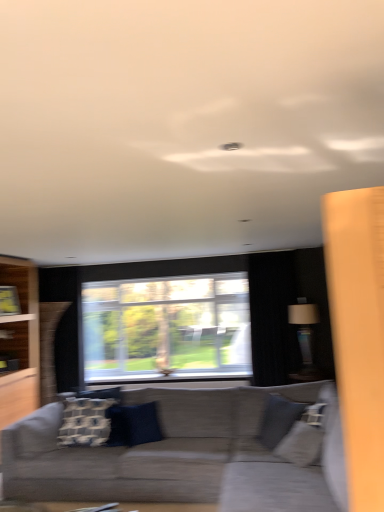
Question: From the image's perspective, is black fabric curtain at right located above or below textured gray couch at center?

Choices:
 (A) above
 (B) below

Answer: (A)

Question: From their relative heights in the image, would you say black fabric curtain at right is taller or shorter than textured gray couch at center?

Choices:
 (A) short
 (B) tall

Answer: (B)

Question: Which is nearer to the black fabric curtain at right?

Choices:
 (A) transparent glass window at center
 (B) white textured pillow at center, which is counted as the first pillow, starting from the left
 (C) matte black lampshade at right
 (D) blue velvet pillow at center, which appears as the second pillow when viewed from the left
 (E) textured gray couch at center

Answer: (C)

Question: Estimate the real-world distances between objects in this image. Which object is farther from the gray fabric swivel chair at lower right?

Choices:
 (A) blue velvet pillow at center, which is the first pillow in right-to-left order
 (B) white textured pillow at center, the 2th pillow positioned from the right
 (C) matte black lampshade at right
 (D) transparent glass window at center
 (E) textured gray couch at center

Answer: (D)